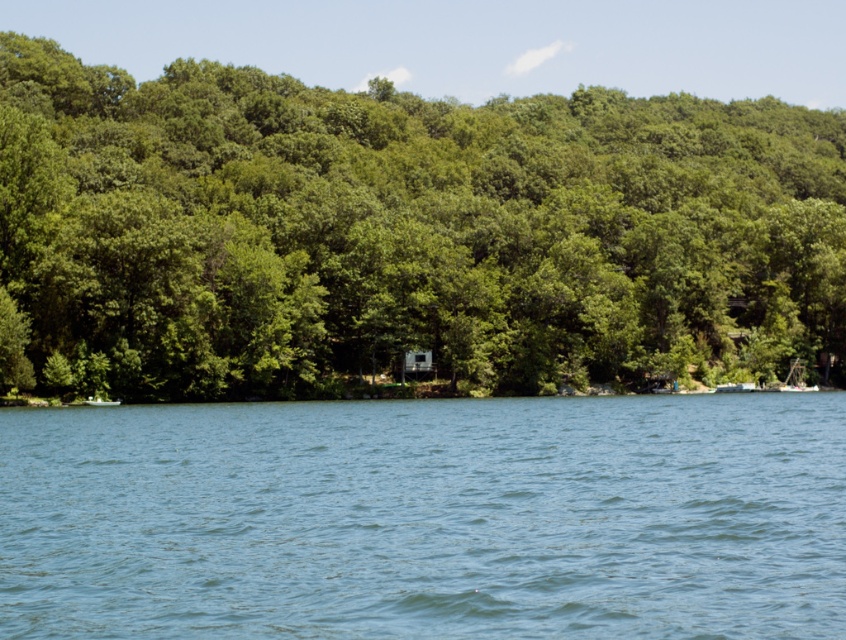
You are a photographer planning to capture the entire scene in one shot. Given that the green leafy tree at center and the blue liquid water at center are both in the frame, which object occupies more horizontal space in the image?

The green leafy tree at center occupies more horizontal space than the blue liquid water at center because its width surpasses the water.

You are standing at the lakeside and want to take a photo of both the point at coordinates [375,291] and the point at coordinates [663,602]. Which point will appear closer to the front of the photo?

The point at coordinates [375,291] will appear closer to the front of the photo because it is further to the camera than the point at coordinates [663,602].

You are a bird looking for a place to perch. You see the green leafy tree at center and the blue liquid water at center. Which one would be a suitable place to land?

The green leafy tree at center is much taller than the blue liquid water at center, so it would be a suitable place to land as trees provide branches for perching while water is not a solid surface.